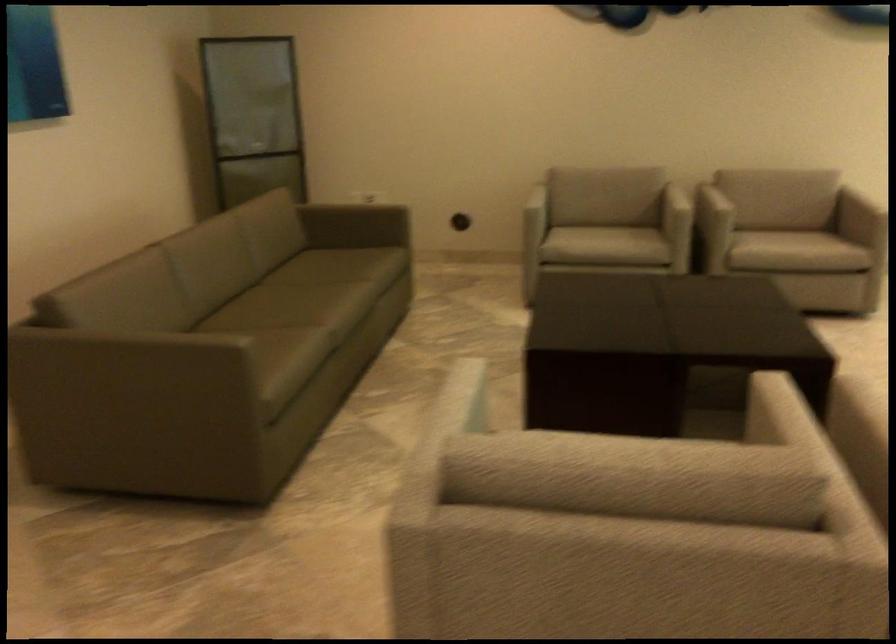
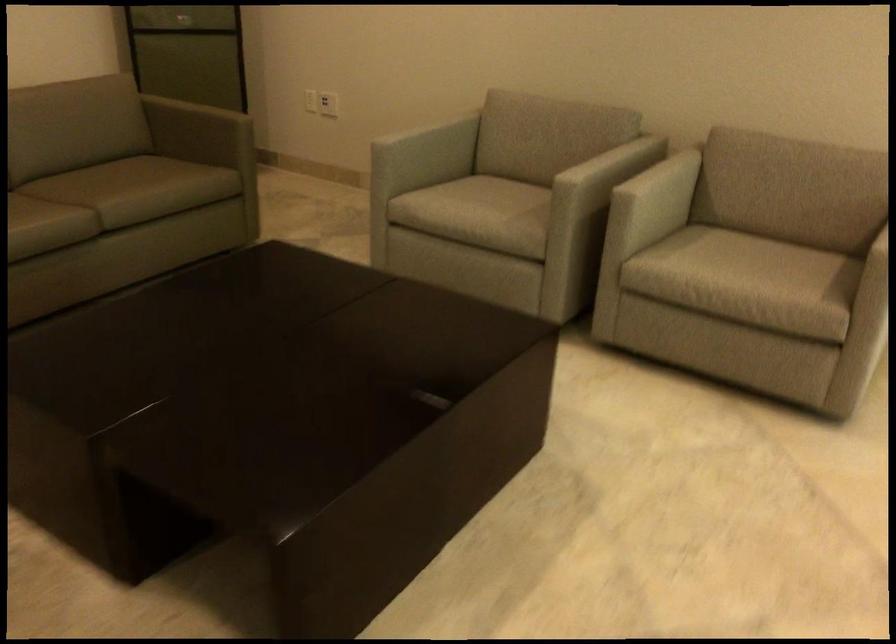
Find the pixel in the second image that matches the point at 605,234 in the first image.

(480, 207)